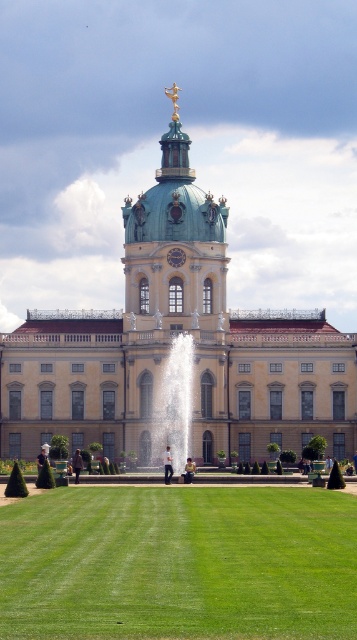
You are standing at the entrance of the grand building and want to walk towards the fountain located on the green grass at center. Based on the coordinates provided, which direction should you move relative to the building?

The green grass at center is located at coordinates point (178, 564), so you should move forward towards the center of the lawn in front of the building to reach the fountain.

You are standing on the lawn in front of the beige stone palace at center and want to walk to the white marble fountain at center. Which direction should you walk to reach the fountain without passing through the palace?

The white marble fountain at center is behind the beige stone palace at center, so you should walk towards the back of the beige stone palace at center to reach the fountain without passing through the palace.

You are planning to host a small outdoor event and need to place a 3x3 meter tent on the green grass at center or the white marble fountain at center. Which location would be suitable based on their sizes?

The green grass at center has a larger size compared to the white marble fountain at center, so the tent can be placed on the green grass at center as it provides enough space.